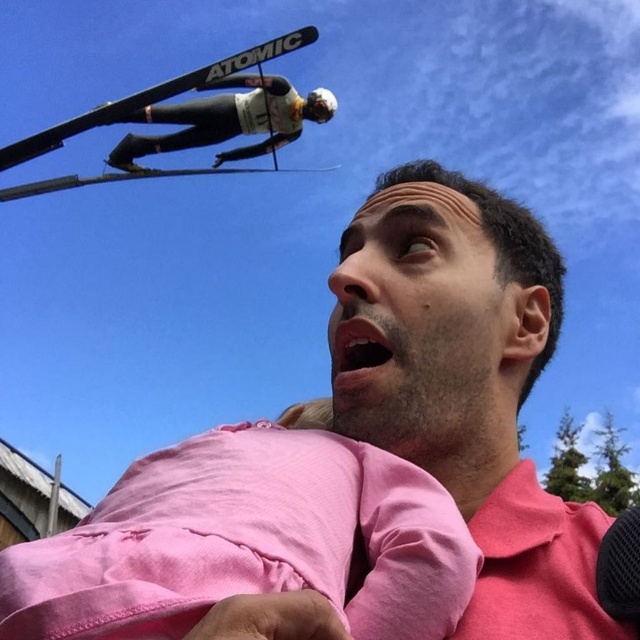
Question: Is pink cotton shirt at center smaller than black matte ski suit at upper left?

Choices:
 (A) no
 (B) yes

Answer: (B)

Question: Which object appears farthest from the camera in this image?

Choices:
 (A) pink cotton shirt at center
 (B) black matte ski suit at upper left

Answer: (B)

Question: Which object is closer to the camera taking this photo?

Choices:
 (A) pink cotton shirt at center
 (B) black matte ski suit at upper left

Answer: (A)

Question: Which point is farther from the camera taking this photo?

Choices:
 (A) (548, 547)
 (B) (269, 100)

Answer: (B)

Question: Does pink cotton shirt at center lie in front of black matte ski suit at upper left?

Choices:
 (A) no
 (B) yes

Answer: (B)

Question: Can you confirm if pink cotton shirt at center is bigger than black matte ski suit at upper left?

Choices:
 (A) no
 (B) yes

Answer: (A)